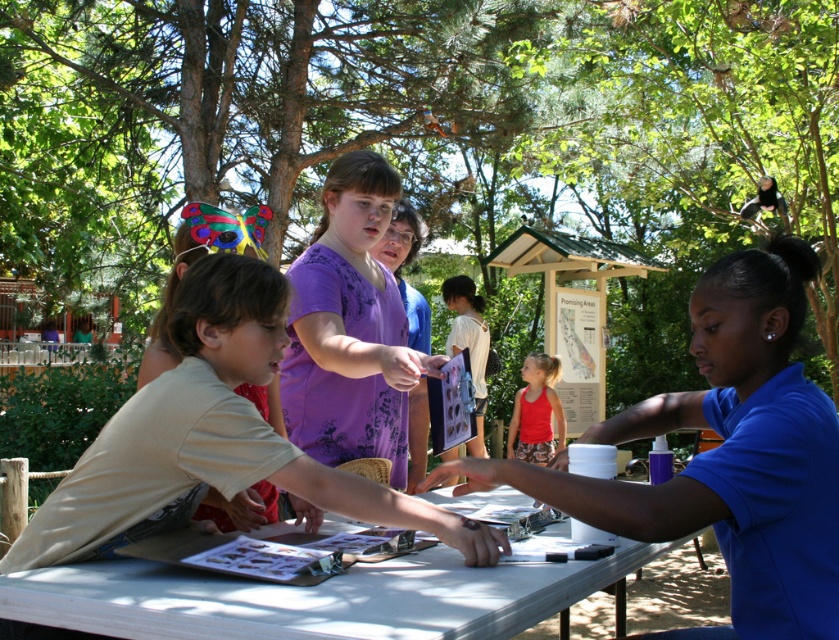
Question: Which point appears farthest from the camera in this image?

Choices:
 (A) (185, 625)
 (B) (282, 440)
 (C) (829, 496)
 (D) (410, 477)

Answer: (D)

Question: Does white plastic table at center have a smaller size compared to purple floral shirt at center?

Choices:
 (A) no
 (B) yes

Answer: (B)

Question: Which point is farther from the camera taking this photo?

Choices:
 (A) (164, 401)
 (B) (414, 440)
 (C) (63, 605)
 (D) (512, 433)

Answer: (D)

Question: Is purple floral shirt at center to the right of matte red tank top at center from the viewer's perspective?

Choices:
 (A) no
 (B) yes

Answer: (A)

Question: Which of the following is the farthest from the observer?

Choices:
 (A) (186, 307)
 (B) (538, 406)
 (C) (795, 496)

Answer: (B)

Question: Is light beige t-shirt at center wider than purple floral shirt at center?

Choices:
 (A) yes
 (B) no

Answer: (A)